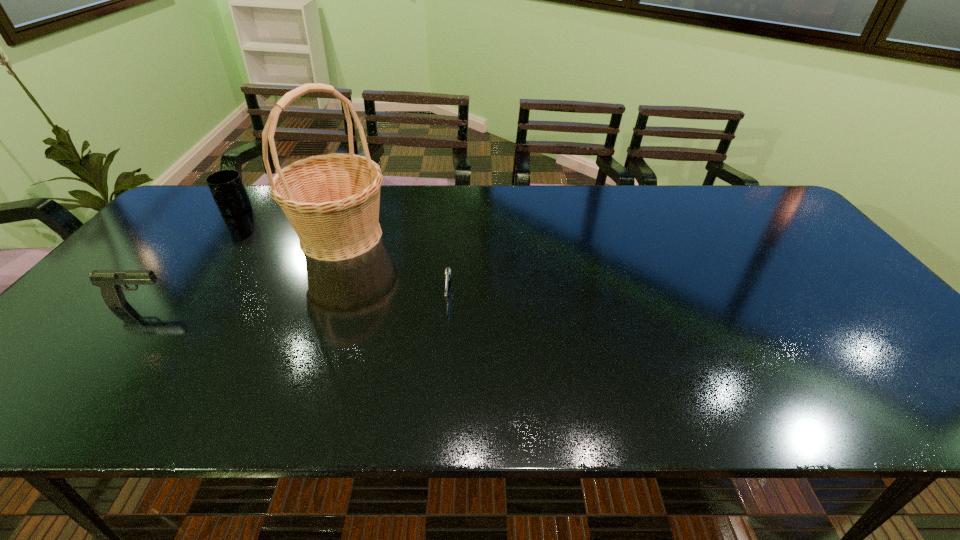
I want to click on the tallest object, so click(x=332, y=201).

Identify the location of the third object from left to right. (332, 201).

Identify the location of mug. (226, 186).

Find the location of `the taller pistol`. the taller pistol is located at coordinates (110, 281).

Where is `the shortest object`? The height and width of the screenshot is (540, 960). the shortest object is located at coordinates (447, 274).

The width and height of the screenshot is (960, 540). I want to click on the shorter pistol, so click(447, 274).

This screenshot has height=540, width=960. In order to click on vacant region located 0.240m on the front of the second object from right to left in this screenshot , I will do `click(301, 334)`.

The image size is (960, 540). I want to click on vacant point located on the side of the mug with the handle, so (214, 238).

I want to click on blank area located 0.160m aim along the barrel of the left pistol, so 234,303.

This screenshot has height=540, width=960. I want to click on free spot located on the front-facing side of the shorter pistol, so click(444, 333).